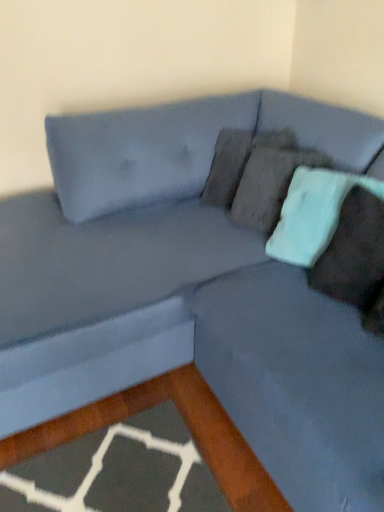
Question: Is teal fabric pillow at right, the 2th pillow from the back, positioned before teal fabric pillow at upper right, which ranks as the first pillow in back-to-front order?

Choices:
 (A) yes
 (B) no

Answer: (A)

Question: Is teal fabric pillow at right, the 2th pillow from the back, turned away from teal fabric pillow at upper right, the second pillow viewed from the front?

Choices:
 (A) yes
 (B) no

Answer: (B)

Question: Considering the relative sizes of teal fabric pillow at right, placed as the 1th pillow when sorted from front to back, and teal fabric pillow at upper right, the second pillow viewed from the front, in the image provided, is teal fabric pillow at right, placed as the 1th pillow when sorted from front to back, smaller than teal fabric pillow at upper right, the second pillow viewed from the front,?

Choices:
 (A) no
 (B) yes

Answer: (B)

Question: Does teal fabric pillow at right, placed as the 1th pillow when sorted from front to back, come behind teal fabric pillow at upper right, the second pillow viewed from the front?

Choices:
 (A) yes
 (B) no

Answer: (B)

Question: From a real-world perspective, is teal fabric pillow at right, the 2th pillow from the back, physically above teal fabric pillow at upper right, the second pillow viewed from the front?

Choices:
 (A) yes
 (B) no

Answer: (B)

Question: Is teal fabric pillow at upper right, which ranks as the first pillow in back-to-front order, completely or partially inside teal fabric pillow at right, the 2th pillow from the back?

Choices:
 (A) yes
 (B) no

Answer: (B)

Question: Considering the relative sizes of teal fabric pillow at upper right, which ranks as the first pillow in back-to-front order, and teal fabric pillow at right, placed as the 1th pillow when sorted from front to back, in the image provided, is teal fabric pillow at upper right, which ranks as the first pillow in back-to-front order, taller than teal fabric pillow at right, placed as the 1th pillow when sorted from front to back,?

Choices:
 (A) yes
 (B) no

Answer: (A)

Question: From the image's perspective, would you say teal fabric pillow at upper right, the second pillow viewed from the front, is positioned over teal fabric pillow at right, placed as the 1th pillow when sorted from front to back?

Choices:
 (A) no
 (B) yes

Answer: (B)

Question: Is teal fabric pillow at upper right, the second pillow viewed from the front, wider than teal fabric pillow at right, the 2th pillow from the back?

Choices:
 (A) yes
 (B) no

Answer: (B)

Question: Is teal fabric pillow at right, placed as the 1th pillow when sorted from front to back, at the back of teal fabric pillow at upper right, the second pillow viewed from the front?

Choices:
 (A) yes
 (B) no

Answer: (B)

Question: Is teal fabric pillow at upper right, the second pillow viewed from the front, closer to camera compared to teal fabric pillow at right, the 2th pillow from the back?

Choices:
 (A) yes
 (B) no

Answer: (B)

Question: From the image's perspective, is teal fabric pillow at upper right, the second pillow viewed from the front, positioned above or below teal fabric pillow at right, the 2th pillow from the back?

Choices:
 (A) below
 (B) above

Answer: (B)